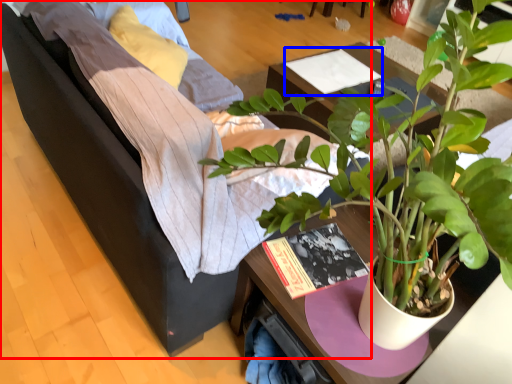
Question: Which object appears farthest to the camera in this image, studio couch (highlighted by a red box) or magazine (highlighted by a blue box)?

Choices:
 (A) studio couch
 (B) magazine

Answer: (B)